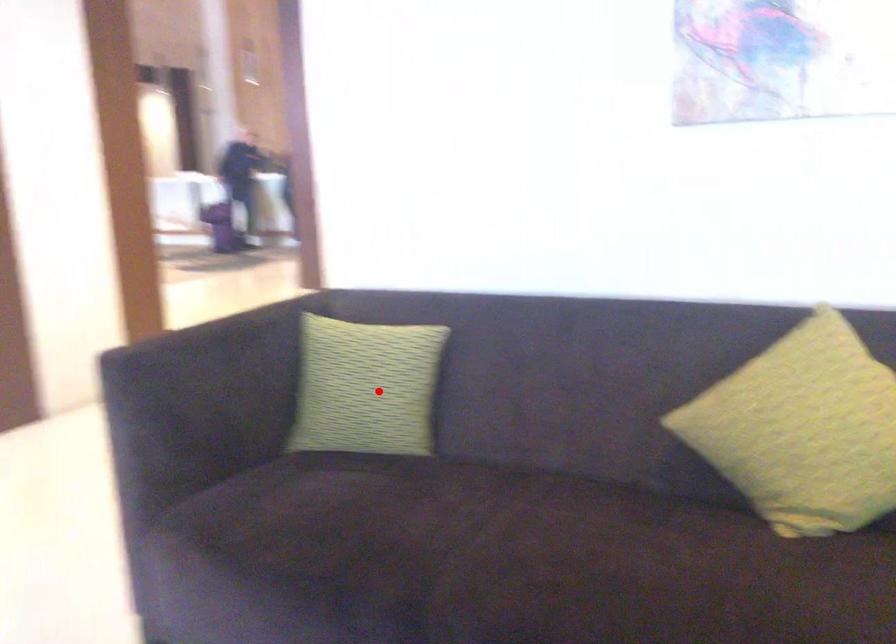
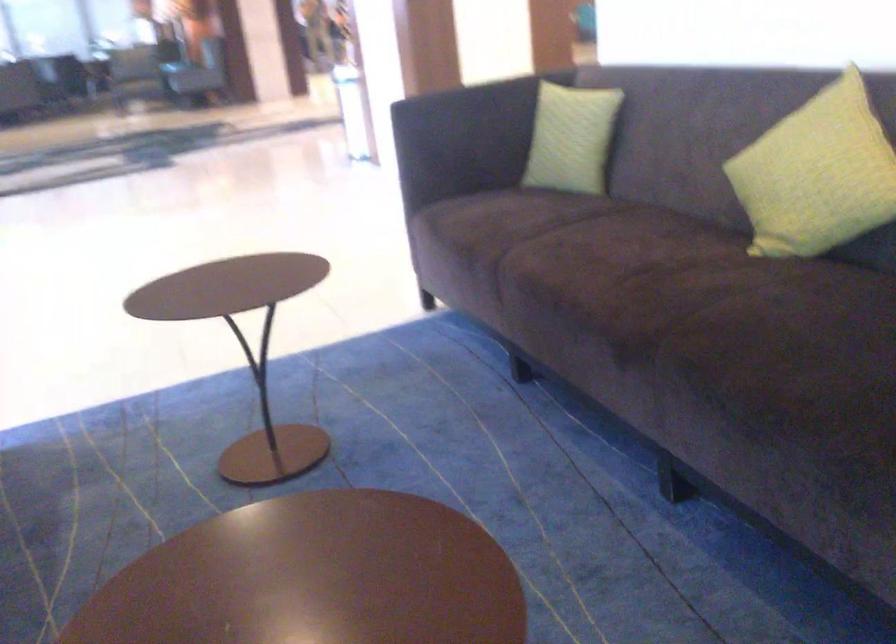
Question: A red point is marked in image1. In image2, is the corresponding 3D point closer to the camera or farther? Reply with the corresponding letter.

Choices:
 (A) The corresponding 3D point is closer.
 (B) The corresponding 3D point is farther.

Answer: (B)